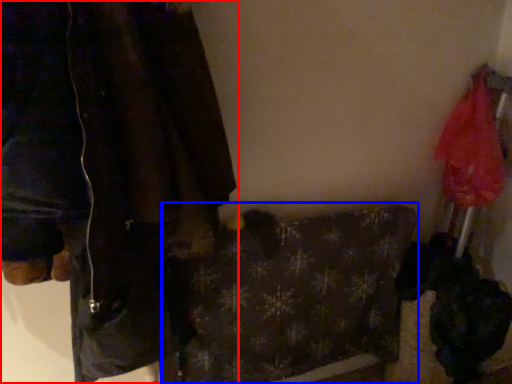
Question: Which of the following is the closest to the observer, jacket (highlighted by a red box) or blanket (highlighted by a blue box)?

Choices:
 (A) jacket
 (B) blanket

Answer: (A)